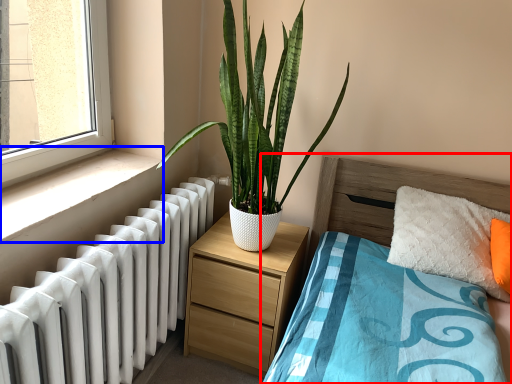
Question: Which of the following is the farthest to the observer, bed (highlighted by a red box) or window sill (highlighted by a blue box)?

Choices:
 (A) bed
 (B) window sill

Answer: (B)